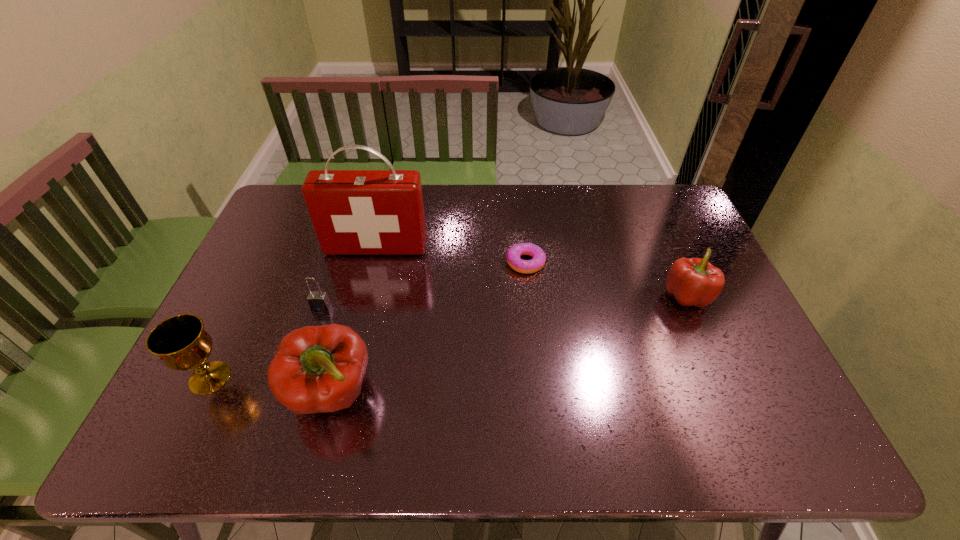
To ensure equal spacing by inserting another bell_pepper among them, please point out a vacant spot for this new bell_pepper. Please provide its 2D coordinates. Your answer should be formatted as a tuple, i.e. [(x, y)], where the tuple contains the x and y coordinates of a point satisfying the conditions above.

[(526, 341)]